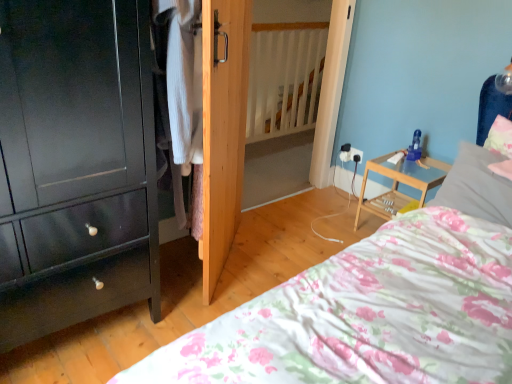
Find the location of a particular element. This screenshot has height=384, width=512. wooden nightstand at right is located at coordinates (398, 184).

At what (x,y) coordinates should I click in order to perform the action: click on fluffy pink pillow at upper right, the 2th pillow when ordered from left to right. Please return your answer as a coordinate pair (x, y). This screenshot has height=384, width=512. Looking at the image, I should click on (501, 145).

Locate an element on the screen. The width and height of the screenshot is (512, 384). blue plastic toy at upper right is located at coordinates (415, 147).

Identify the location of knitted wool sweater at center. This screenshot has width=512, height=384. (179, 105).

The height and width of the screenshot is (384, 512). Describe the element at coordinates (476, 186) in the screenshot. I see `white soft pillow at upper right, marked as the 2th pillow in a right-to-left arrangement` at that location.

The height and width of the screenshot is (384, 512). Identify the location of natural wood door at center. (223, 128).

Between point (421, 151) and point (422, 197), which one is positioned behind?

The point (421, 151) is more distant.

Based on their positions, is blue plastic toy at upper right located to the left or right of wooden nightstand at right?

Based on their positions, blue plastic toy at upper right is located to the right of wooden nightstand at right.

Are blue plastic toy at upper right and wooden nightstand at right beside each other?

No, blue plastic toy at upper right is not making contact with wooden nightstand at right.

Does point (482, 347) appear closer or farther from the camera than point (178, 9)?

Point (482, 347) is positioned closer to the camera compared to point (178, 9).

From a real-world perspective, which is physically above, floral cotton bed at lower right or knitted wool sweater at center?

From a 3D spatial view, knitted wool sweater at center is above.

From the image's perspective, which is below, floral cotton bed at lower right or knitted wool sweater at center?

floral cotton bed at lower right, from the image's perspective.

Based on the photo, would you say floral cotton bed at lower right is inside or outside knitted wool sweater at center?

floral cotton bed at lower right is spatially situated outside knitted wool sweater at center.

Can you confirm if white soft pillow at upper right, which is the 1th pillow from left to right, is shorter than floral cotton bed at lower right?

Yes.

From a real-world perspective, relative to floral cotton bed at lower right, is white soft pillow at upper right, which is the 1th pillow from left to right, vertically above or below?

From a real-world perspective, white soft pillow at upper right, which is the 1th pillow from left to right, is physically above floral cotton bed at lower right.

From a real-world perspective, is floral cotton bed at lower right below blue plastic toy at upper right?

Indeed, from a real-world perspective, floral cotton bed at lower right is positioned beneath blue plastic toy at upper right.

Is point (476, 349) closer to camera compared to point (406, 157)?

Yes, it is in front of point (406, 157).

Considering the sizes of objects floral cotton bed at lower right and blue plastic toy at upper right in the image provided, who is taller, floral cotton bed at lower right or blue plastic toy at upper right?

Standing taller between the two is floral cotton bed at lower right.

Is floral cotton bed at lower right wider than blue plastic toy at upper right?

Yes.

Is fluffy pink pillow at upper right, the first pillow in the right-to-left sequence, aimed at natural wood door at center?

No, fluffy pink pillow at upper right, the first pillow in the right-to-left sequence, is not aimed at natural wood door at center.

Which is in front, point (500, 119) or point (206, 78)?

The point (206, 78) is more forward.

From a real-world perspective, which object stands above the other?

From a 3D spatial view, fluffy pink pillow at upper right, the first pillow in the right-to-left sequence, is above.

Which of these two, fluffy pink pillow at upper right, the 2th pillow when ordered from left to right, or natural wood door at center, stands shorter?

fluffy pink pillow at upper right, the 2th pillow when ordered from left to right.

Consider the image. Does fluffy pink pillow at upper right, the 2th pillow when ordered from left to right, have a greater height compared to floral cotton bed at lower right?

In fact, fluffy pink pillow at upper right, the 2th pillow when ordered from left to right, may be shorter than floral cotton bed at lower right.

Based on their sizes in the image, would you say fluffy pink pillow at upper right, the first pillow in the right-to-left sequence, is bigger or smaller than floral cotton bed at lower right?

In the image, fluffy pink pillow at upper right, the first pillow in the right-to-left sequence, appears to be smaller than floral cotton bed at lower right.

At what (x,y) coordinates should I click in order to perform the action: click on bed to the left of fluffy pink pillow at upper right, the 2th pillow when ordered from left to right. Please return your answer as a coordinate pair (x, y). This screenshot has width=512, height=384. Looking at the image, I should click on (367, 315).

Which is less distant, (507, 170) or (338, 357)?

The point (338, 357) is in front.

Is point (390, 250) behind point (449, 182)?

No, (390, 250) is in front of (449, 182).

From the image's perspective, relative to white soft pillow at upper right, which is the 1th pillow from left to right, is floral cotton bed at lower right above or below?

Clearly, from the image's perspective, floral cotton bed at lower right is below white soft pillow at upper right, which is the 1th pillow from left to right.

Between floral cotton bed at lower right and white soft pillow at upper right, which is the 1th pillow from left to right, which one appears on the right side from the viewer's perspective?

Positioned to the right is white soft pillow at upper right, which is the 1th pillow from left to right.

I want to click on nightstand in front of the blue plastic toy at upper right, so click(x=398, y=184).

Identify the location of bed on the right side of knitted wool sweater at center. The height and width of the screenshot is (384, 512). (367, 315).

From the image, which object appears to be nearer to matte black cabinet at left, fluffy pink pillow at upper right, the 2th pillow when ordered from left to right, or white soft pillow at upper right, which is the 1th pillow from left to right?

The object closer to matte black cabinet at left is white soft pillow at upper right, which is the 1th pillow from left to right.

Which object lies further to the anchor point knitted wool sweater at center, matte black cabinet at left or blue plastic toy at upper right?

Among the two, blue plastic toy at upper right is located further to knitted wool sweater at center.

When comparing their distances from white soft pillow at upper right, marked as the 2th pillow in a right-to-left arrangement, does knitted wool sweater at center or floral cotton bed at lower right seem closer?

floral cotton bed at lower right is positioned closer to the anchor white soft pillow at upper right, marked as the 2th pillow in a right-to-left arrangement.

Looking at the image, which one is located closer to matte black cabinet at left, floral cotton bed at lower right or fluffy pink pillow at upper right, the first pillow in the right-to-left sequence?

Based on the image, floral cotton bed at lower right appears to be nearer to matte black cabinet at left.

Estimate the real-world distances between objects in this image. Which object is closer to natural wood door at center, blue plastic toy at upper right or floral cotton bed at lower right?

floral cotton bed at lower right lies closer to natural wood door at center than the other object.

Which object lies nearer to the anchor point matte black cabinet at left, white soft pillow at upper right, marked as the 2th pillow in a right-to-left arrangement, or natural wood door at center?

natural wood door at center.

Estimate the real-world distances between objects in this image. Which object is further from matte black cabinet at left, fluffy pink pillow at upper right, the 2th pillow when ordered from left to right, or wooden nightstand at right?

Among the two, fluffy pink pillow at upper right, the 2th pillow when ordered from left to right, is located further to matte black cabinet at left.

From the image, which object appears to be nearer to natural wood door at center, wooden nightstand at right or knitted wool sweater at center?

knitted wool sweater at center.

At what (x,y) coordinates should I click in order to perform the action: click on door between matte black cabinet at left and wooden nightstand at right in the horizontal direction. Please return your answer as a coordinate pair (x, y). Image resolution: width=512 pixels, height=384 pixels. Looking at the image, I should click on (223, 128).

Image resolution: width=512 pixels, height=384 pixels. Find the location of `clothing situated between matte black cabinet at left and wooden nightstand at right from left to right`. clothing situated between matte black cabinet at left and wooden nightstand at right from left to right is located at coordinates (179, 105).

This screenshot has width=512, height=384. What are the coordinates of `clothing between floral cotton bed at lower right and wooden nightstand at right from front to back` in the screenshot? It's located at (179, 105).

In order to click on nightstand between floral cotton bed at lower right and blue plastic toy at upper right in the front-back direction in this screenshot , I will do [398, 184].